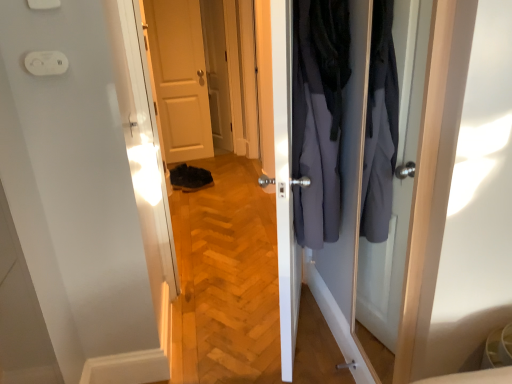
Where is `free space in front of black suede shoe at lower center`? This screenshot has width=512, height=384. free space in front of black suede shoe at lower center is located at coordinates (192, 197).